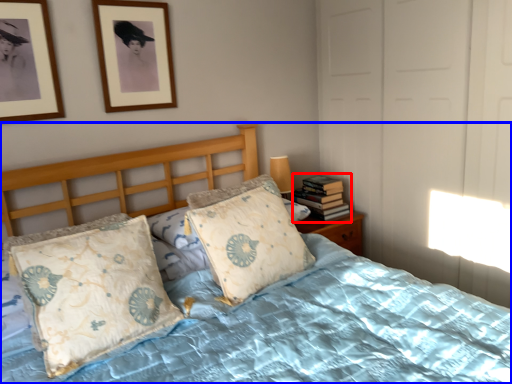
Question: Which object appears closest to the camera in this image, book (highlighted by a red box) or bed (highlighted by a blue box)?

Choices:
 (A) book
 (B) bed

Answer: (B)